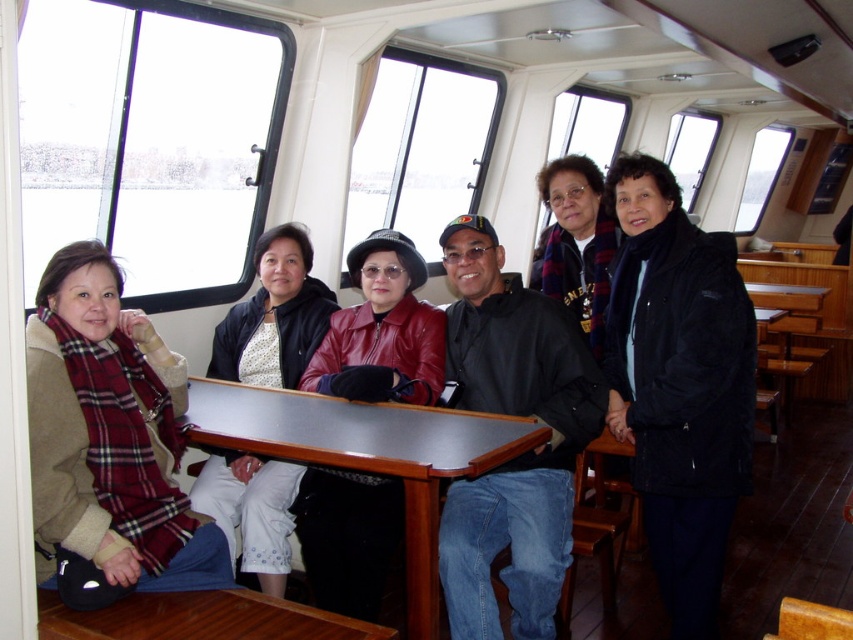
Does leather jacket at center come behind wooden table at center?

That is True.

Is leather jacket at center closer to camera compared to wooden table at center?

No, leather jacket at center is behind wooden table at center.

Between point (387, 563) and point (68, 616), which one is positioned in front?

Positioned in front is point (68, 616).

Locate an element on the screen. This screenshot has width=853, height=640. leather jacket at center is located at coordinates (383, 326).

Between plaid scarf at left and metallic polished table at center, which one appears on the left side from the viewer's perspective?

plaid scarf at left

Between point (132, 456) and point (433, 468), which one is positioned in front?

Point (433, 468) is more forward.

I want to click on plaid scarf at left, so click(x=109, y=435).

Who is shorter, white textured pants at center or wooden table at center?

With less height is wooden table at center.

Can you confirm if white textured pants at center is bigger than wooden table at center?

Yes.

Is point (241, 476) in front of point (171, 627)?

That is False.

Identify the location of white textured pants at center. The height and width of the screenshot is (640, 853). (274, 316).